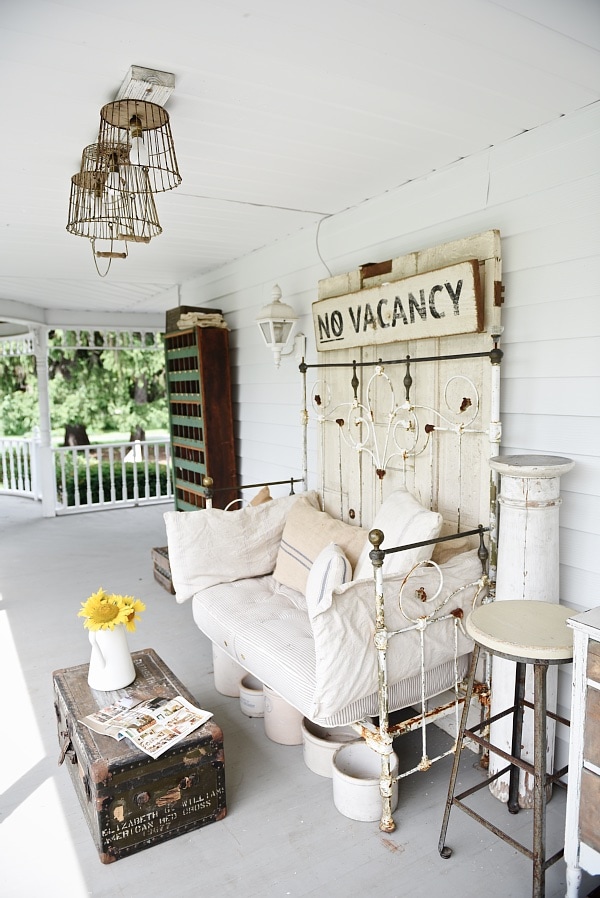
At what (x,y) coordinates should I click in order to perform the action: click on ceiling. Please return your answer as a coordinate pair (x, y). Looking at the image, I should click on (365, 124).